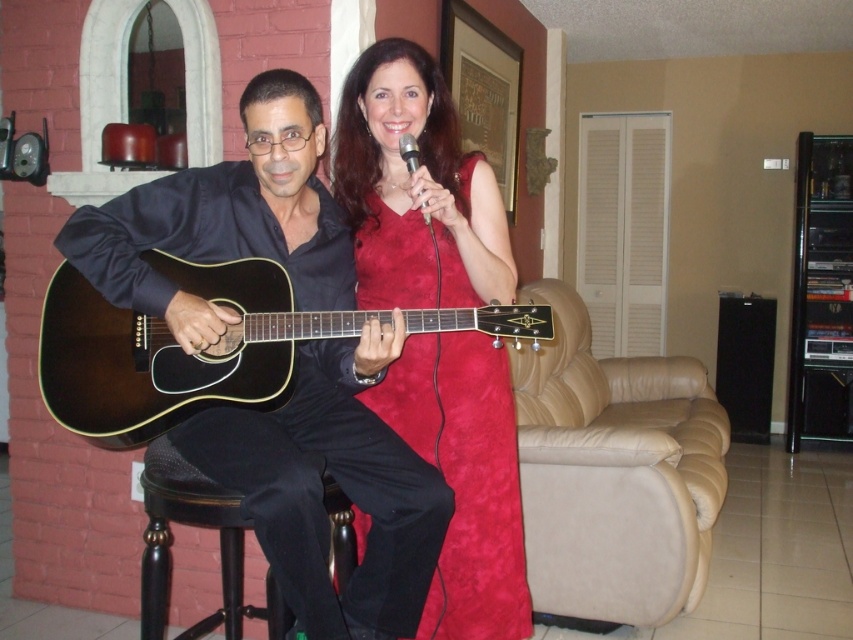
Question: Which object is closer to the camera taking this photo?

Choices:
 (A) black wood bar stool at lower left
 (B) beige leather armchair at right
 (C) shiny black guitar at left
 (D) velvet red dress at center

Answer: (C)

Question: Does shiny black guitar at left appear on the left side of beige leather armchair at right?

Choices:
 (A) yes
 (B) no

Answer: (A)

Question: Which object is closer to the camera taking this photo?

Choices:
 (A) shiny black guitar at left
 (B) black wood bar stool at lower left
 (C) matte black acoustic guitar at left
 (D) velvet red dress at center

Answer: (A)

Question: Estimate the real-world distances between objects in this image. Which object is farther from the beige leather armchair at right?

Choices:
 (A) black wood bar stool at lower left
 (B) velvet red dress at center

Answer: (A)

Question: Is shiny black guitar at left bigger than matte black acoustic guitar at left?

Choices:
 (A) yes
 (B) no

Answer: (A)

Question: Is shiny black guitar at left further to camera compared to beige leather armchair at right?

Choices:
 (A) yes
 (B) no

Answer: (B)